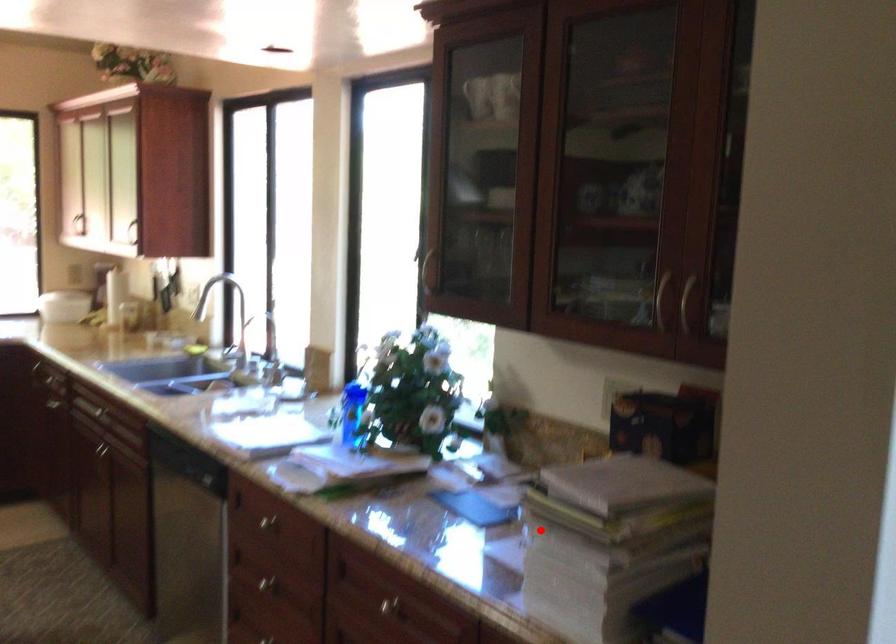
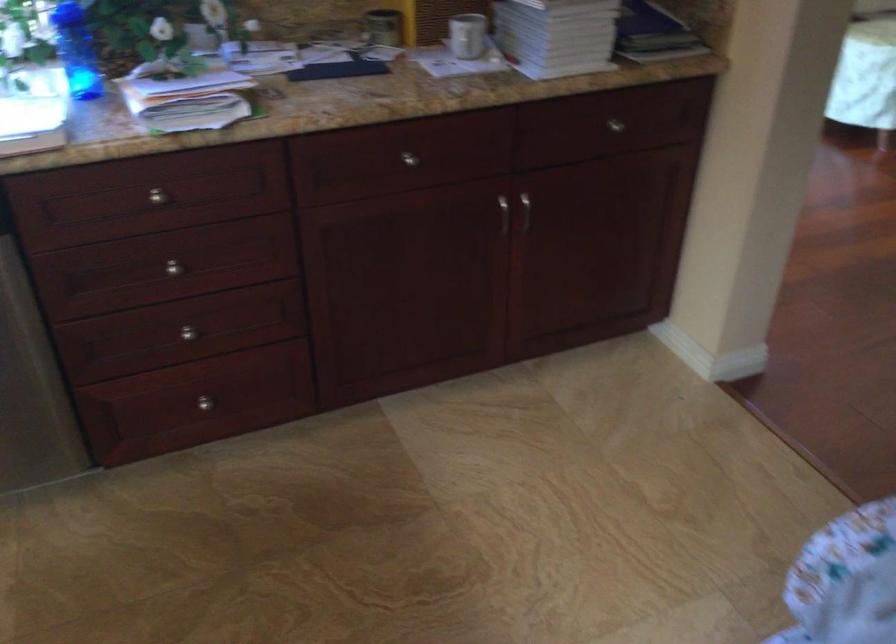
Find the pixel in the second image that matches the highlighted location in the first image.

(467, 35)